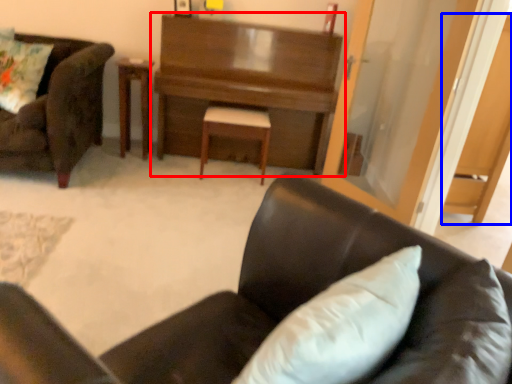
Question: Which object appears closest to the camera in this image, desk (highlighted by a red box) or dark (highlighted by a blue box)?

Choices:
 (A) desk
 (B) dark

Answer: (B)